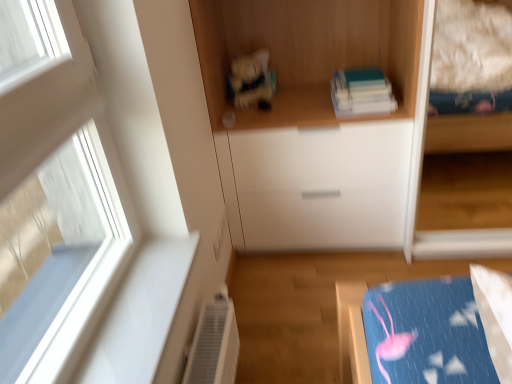
Find the location of a particular element. vacant space situated above hardcover book at upper center (from a real-world perspective) is located at coordinates (358, 73).